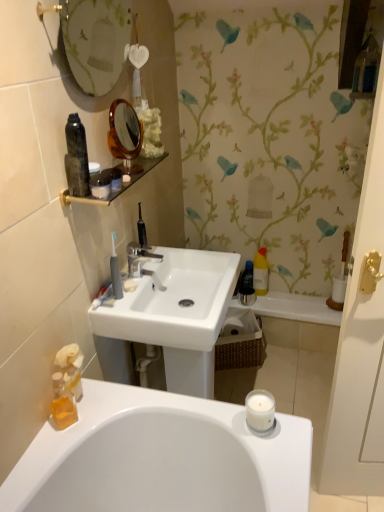
This screenshot has height=512, width=384. In order to click on vacant space to the right of yellow translucent bottle at right, the 2th bottle when ordered from left to right in this screenshot , I will do `click(289, 296)`.